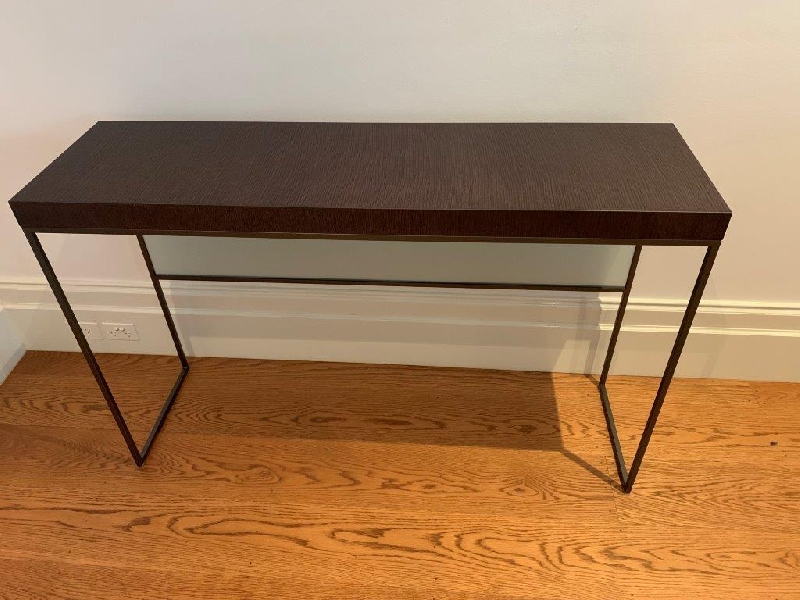
This screenshot has width=800, height=600. I want to click on table leg, so click(140, 460).